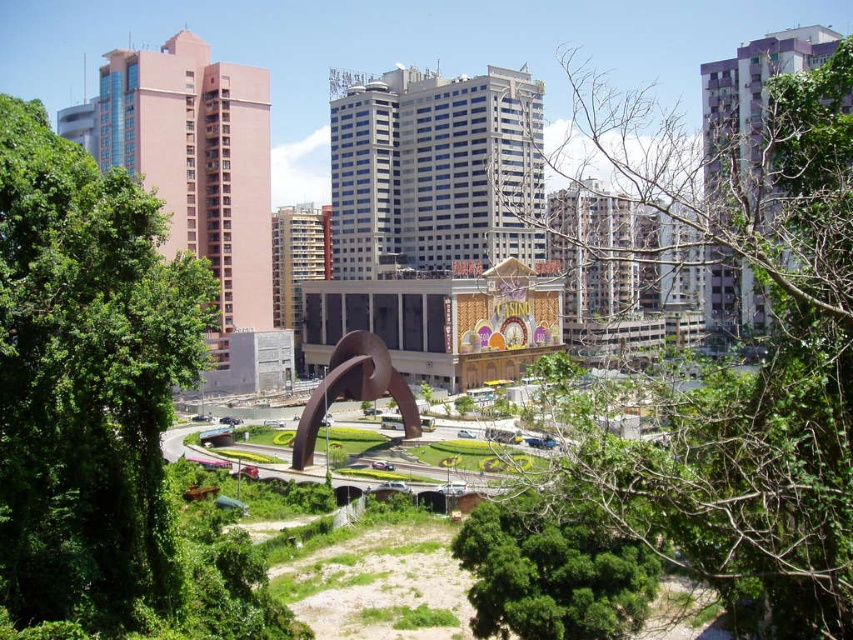
Question: Considering the relative positions of green leafy tree at center and brown polished metal sculpture at center in the image provided, where is green leafy tree at center located with respect to brown polished metal sculpture at center?

Choices:
 (A) above
 (B) below

Answer: (A)

Question: Is green leafy tree at left wider than brown polished metal sculpture at center?

Choices:
 (A) no
 (B) yes

Answer: (B)

Question: Which of the following is the closest to the observer?

Choices:
 (A) (607, 524)
 (B) (65, 211)
 (C) (418, 412)

Answer: (B)

Question: Which of the following is the farthest from the observer?

Choices:
 (A) (370, 349)
 (B) (73, 323)
 (C) (659, 188)
 (D) (512, 516)

Answer: (A)

Question: Among these points, which one is farthest from the camera?

Choices:
 (A) (573, 516)
 (B) (541, 506)

Answer: (B)

Question: Is green leafy tree at center further to the viewer compared to green leafy tree at lower center?

Choices:
 (A) yes
 (B) no

Answer: (B)